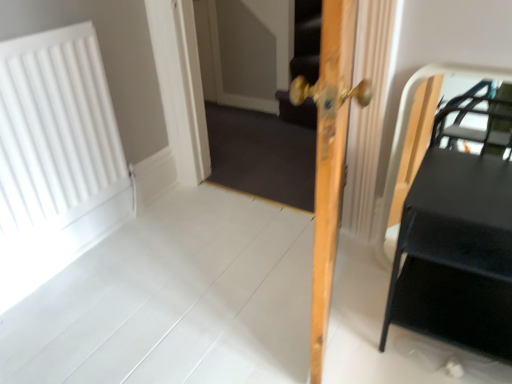
Question: From a real-world perspective, is wooden screen door at center below black matte table at right?

Choices:
 (A) no
 (B) yes

Answer: (A)

Question: Is wooden screen door at center looking in the opposite direction of black matte table at right?

Choices:
 (A) yes
 (B) no

Answer: (B)

Question: From the image's perspective, does wooden screen door at center appear lower than black matte table at right?

Choices:
 (A) yes
 (B) no

Answer: (B)

Question: Can you confirm if wooden screen door at center is shorter than black matte table at right?

Choices:
 (A) yes
 (B) no

Answer: (B)

Question: Is wooden screen door at center closer to camera compared to black matte table at right?

Choices:
 (A) no
 (B) yes

Answer: (A)

Question: Can you confirm if wooden screen door at center is thinner than black matte table at right?

Choices:
 (A) no
 (B) yes

Answer: (B)

Question: Is wooden screen door at center bigger than light wood door at center?

Choices:
 (A) no
 (B) yes

Answer: (B)

Question: Considering the relative sizes of wooden screen door at center and light wood door at center in the image provided, is wooden screen door at center taller than light wood door at center?

Choices:
 (A) yes
 (B) no

Answer: (B)

Question: From a real-world perspective, is wooden screen door at center on light wood door at center?

Choices:
 (A) no
 (B) yes

Answer: (A)

Question: Is wooden screen door at center facing away from light wood door at center?

Choices:
 (A) no
 (B) yes

Answer: (A)

Question: From a real-world perspective, is wooden screen door at center positioned under light wood door at center based on gravity?

Choices:
 (A) yes
 (B) no

Answer: (A)

Question: Can you confirm if wooden screen door at center is thinner than light wood door at center?

Choices:
 (A) no
 (B) yes

Answer: (B)

Question: From the image's perspective, is white matte radiator at left on top of light wood door at center?

Choices:
 (A) no
 (B) yes

Answer: (B)